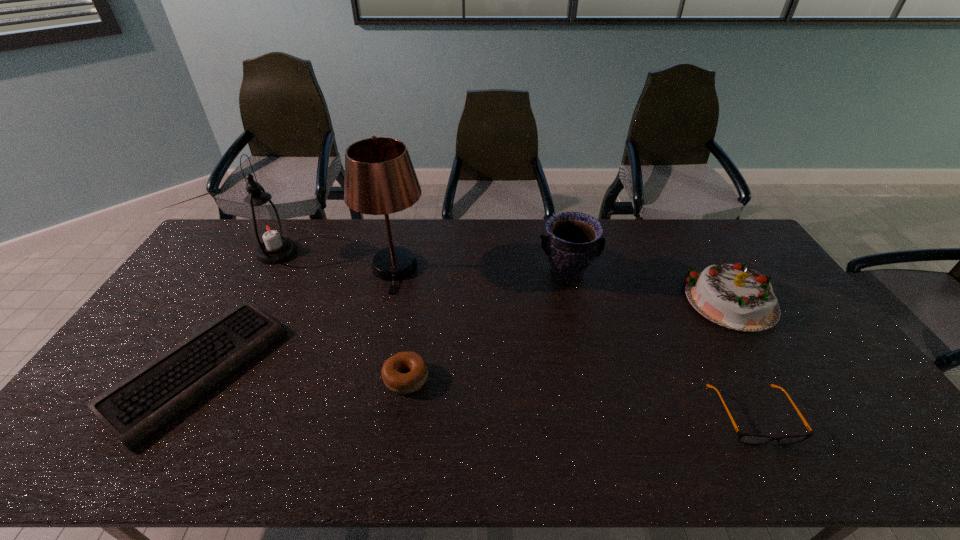
At what (x,y) coordinates should I click in order to perform the action: click on object at the near left corner. Please return your answer as a coordinate pair (x, y). This screenshot has width=960, height=540. Looking at the image, I should click on (134, 409).

At what (x,y) coordinates should I click in order to perform the action: click on free space at the far edge of the desktop. Please return your answer as a coordinate pair (x, y). Looking at the image, I should click on (291, 225).

Image resolution: width=960 pixels, height=540 pixels. In the image, there is a desktop. Identify the location of vacant space at the near edge. (295, 453).

This screenshot has height=540, width=960. Identify the location of vacant space at the right edge. (859, 407).

This screenshot has width=960, height=540. In the image, there is a desktop. What are the coordinates of `blank space at the far left corner` in the screenshot? It's located at (243, 238).

Image resolution: width=960 pixels, height=540 pixels. In order to click on free space at the far right corner in this screenshot , I will do `click(706, 230)`.

Locate an element on the screen. This screenshot has width=960, height=540. free space between the cake and the spectacles is located at coordinates (743, 359).

You are a GUI agent. You are given a task and a screenshot of the screen. Output one action in this format:
    pyautogui.click(x=<x>, y=<y>)
    Task: Click on the vacant region between the spectacles and the second tallest object
    
    Given the screenshot: What is the action you would take?
    pyautogui.click(x=516, y=334)

Locate an element on the screen. The height and width of the screenshot is (540, 960). unoccupied position between the spectacles and the bagel is located at coordinates (580, 396).

This screenshot has width=960, height=540. I want to click on vacant space that is in between the computer keyboard and the fourth tallest object, so click(465, 336).